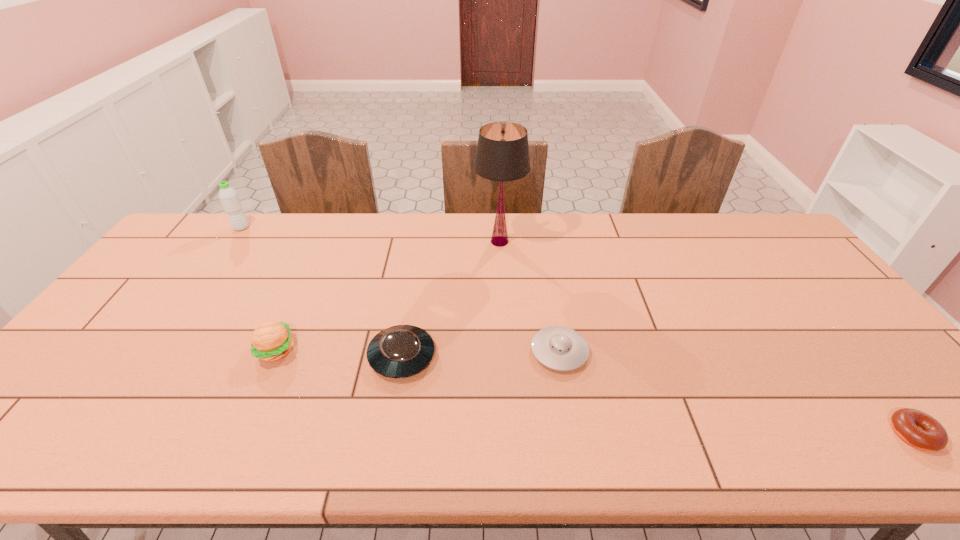
Locate an element on the screen. This screenshot has width=960, height=540. empty space between the fifth tallest object and the tallest object is located at coordinates (530, 296).

Find the location of a particular element. This screenshot has height=540, width=960. vacant area that lies between the shorter saucer and the leftmost object is located at coordinates (400, 289).

The height and width of the screenshot is (540, 960). In order to click on unoccupied position between the fourth tallest object and the fourth shortest object in this screenshot , I will do `click(339, 353)`.

Identify the location of free space between the right saucer and the lampshade. Image resolution: width=960 pixels, height=540 pixels. 530,296.

The image size is (960, 540). Find the location of `free space between the taller saucer and the fifth tallest object`. free space between the taller saucer and the fifth tallest object is located at coordinates (481, 354).

Where is `vacant area that lies between the leftmost object and the fourth tallest object`? vacant area that lies between the leftmost object and the fourth tallest object is located at coordinates (322, 292).

Where is `free space between the rightmost object and the lampshade`? This screenshot has height=540, width=960. free space between the rightmost object and the lampshade is located at coordinates pos(707,338).

Locate which object ranks third in proximity to the doughnut. Please provide its 2D coordinates. Your answer should be formatted as a tuple, i.e. [(x, y)], where the tuple contains the x and y coordinates of a point satisfying the conditions above.

[(400, 351)]

The width and height of the screenshot is (960, 540). I want to click on object that is the second closest to the hamburger, so click(x=228, y=196).

I want to click on free location that satisfies the following two spatial constraints: 1. on the front side of the leftmost object; 2. on the right side of the taller saucer, so point(150,356).